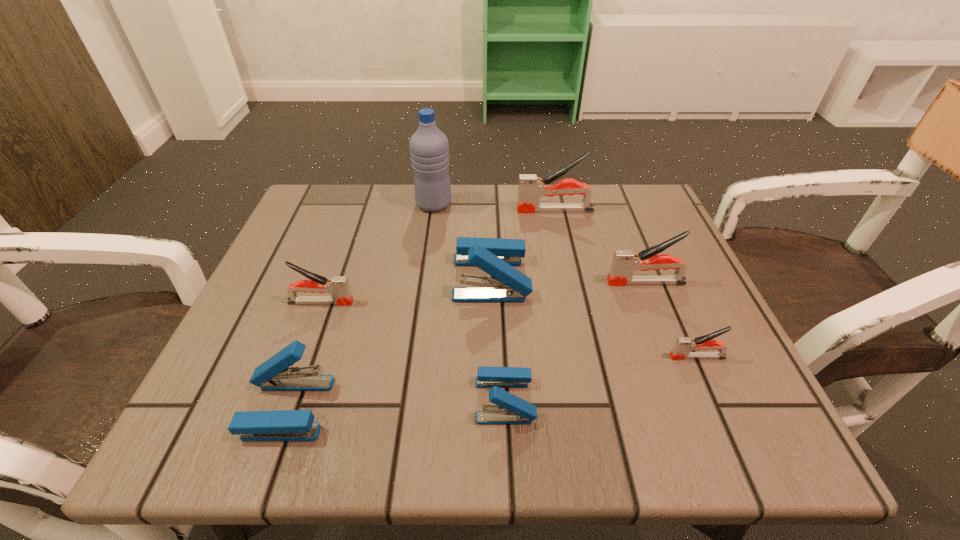
I want to click on gray stapler that is the closest one to the second biggest gray stapler, so click(x=683, y=345).

Identify which blue stapler is located as the nearest to the leftmost blue stapler. Please provide its 2D coordinates. Your answer should be formatted as a tuple, i.e. [(x, y)], where the tuple contains the x and y coordinates of a point satisfying the conditions above.

[(509, 409)]

Locate an element on the screen. blue stapler that stands as the closest to the smallest blue stapler is located at coordinates (495, 256).

The height and width of the screenshot is (540, 960). Find the location of `free space that satisfies the following two spatial constraints: 1. on the handle side of the leftmost gray stapler; 2. on the back side of the leftmost blue stapler`. free space that satisfies the following two spatial constraints: 1. on the handle side of the leftmost gray stapler; 2. on the back side of the leftmost blue stapler is located at coordinates (282, 407).